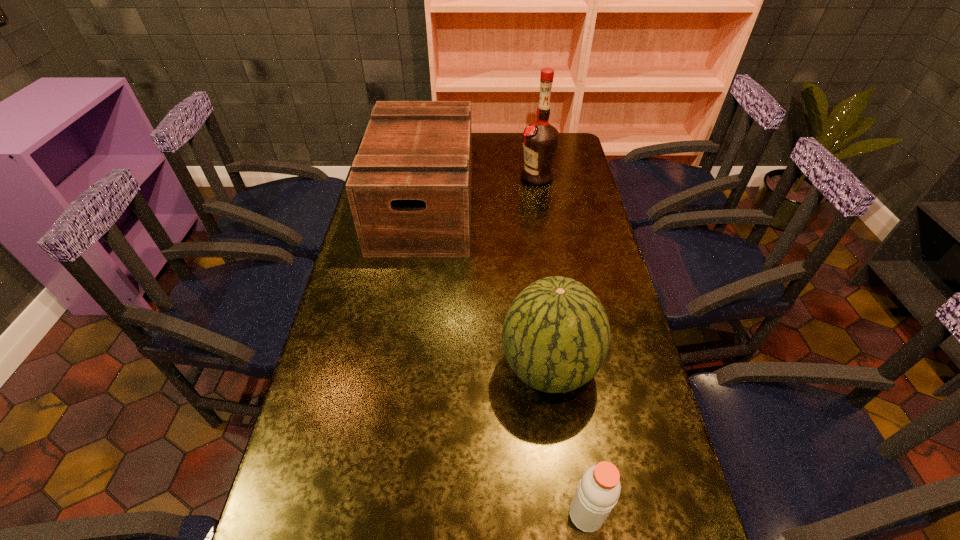
I want to click on the tallest object, so click(540, 140).

Locate an element on the screen. The height and width of the screenshot is (540, 960). box is located at coordinates (409, 189).

I want to click on watermelon, so click(x=556, y=334).

Where is `the shortest object`? the shortest object is located at coordinates (599, 489).

Locate an element on the screen. shaker is located at coordinates (599, 489).

Find the location of a particular element. The image size is (960, 540). vacant region located on the front and back of the liquor is located at coordinates (431, 177).

The height and width of the screenshot is (540, 960). In order to click on vacant area located on the front and back of the liquor in this screenshot , I will do `click(423, 177)`.

Where is `vacant area situated on the front and back of the liquor`? Image resolution: width=960 pixels, height=540 pixels. vacant area situated on the front and back of the liquor is located at coordinates (459, 177).

Locate an element on the screen. free space located 0.100m on the front of the box is located at coordinates 413,280.

You are a GUI agent. You are given a task and a screenshot of the screen. Output one action in this format:
    pyautogui.click(x=<x>, y=<y>)
    Task: Click on the vacant space located 0.080m on the front of the second nearest object
    The image size is (960, 540).
    Given the screenshot: What is the action you would take?
    pyautogui.click(x=558, y=445)